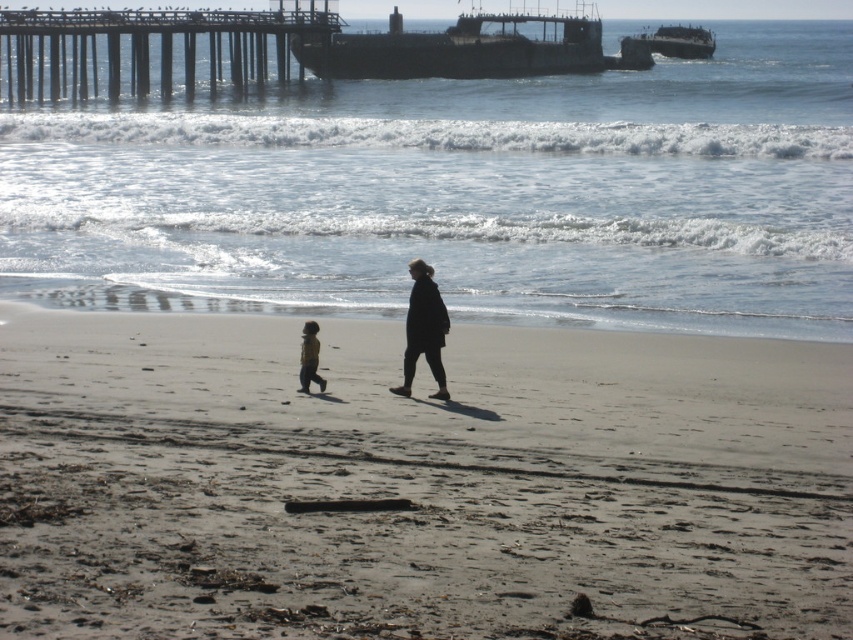
The image size is (853, 640). What do you see at coordinates (465, 49) in the screenshot? I see `dark gray metallic ship at upper center` at bounding box center [465, 49].

Can you confirm if dark gray metallic ship at upper center is positioned to the right of light brown fabric jacket at lower center?

Correct, you'll find dark gray metallic ship at upper center to the right of light brown fabric jacket at lower center.

Identify the location of dark gray metallic ship at upper center. (465, 49).

Can you confirm if dark gray wool coat at center is taller than rusty metal shipwreck at upper center?

In fact, dark gray wool coat at center may be shorter than rusty metal shipwreck at upper center.

Is dark gray wool coat at center shorter than rusty metal shipwreck at upper center?

Indeed, dark gray wool coat at center has a lesser height compared to rusty metal shipwreck at upper center.

You are a GUI agent. You are given a task and a screenshot of the screen. Output one action in this format:
    pyautogui.click(x=<x>, y=<y>)
    Task: Click on the dark gray wool coat at center
    This screenshot has height=640, width=853.
    Given the screenshot: What is the action you would take?
    pyautogui.click(x=424, y=330)

Can you confirm if wooden planks at upper left is bigger than dark gray wool coat at center?

Yes.

This screenshot has height=640, width=853. In order to click on wooden planks at upper left in this screenshot , I will do `click(148, 48)`.

Is point (125, 20) positioned before point (436, 372)?

No, it is behind (436, 372).

Locate an element on the screen. This screenshot has height=640, width=853. wooden planks at upper left is located at coordinates (148, 48).